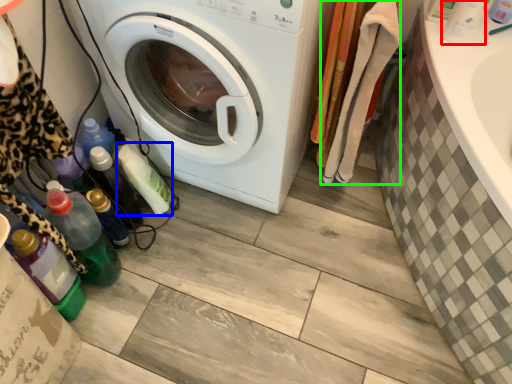
Question: Which object is positioned closest to bottle (highlighted by a red box)? Select from bottle (highlighted by a blue box) and clothing (highlighted by a green box).

Choices:
 (A) bottle
 (B) clothing

Answer: (B)